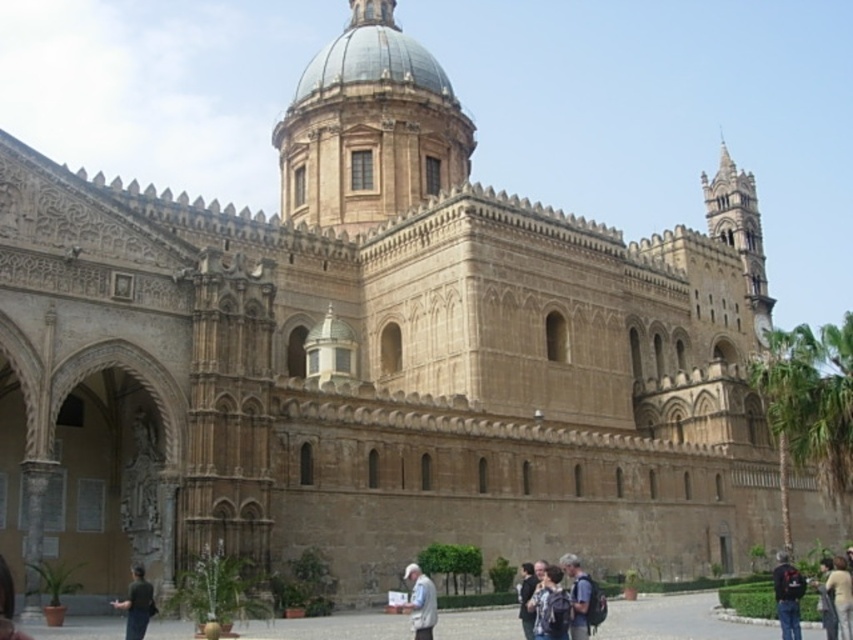
Question: Is light brown leather jacket at lower right smaller than dark gray backpack at lower center?

Choices:
 (A) no
 (B) yes

Answer: (A)

Question: Does light gray fabric jacket at lower center appear over light brown leather jacket at lower right?

Choices:
 (A) no
 (B) yes

Answer: (B)

Question: Is black fabric backpack at lower right to the left of light brown leather jacket at lower right from the viewer's perspective?

Choices:
 (A) no
 (B) yes

Answer: (B)

Question: Which point appears closest to the camera in this image?

Choices:
 (A) (4, 612)
 (B) (532, 577)
 (C) (828, 577)
 (D) (550, 577)

Answer: (A)

Question: Among these objects, which one is nearest to the camera?

Choices:
 (A) dark gray backpack at lower center
 (B) light brown leather jacket at center
 (C) white fabric shirt at center
 (D) light brown leather jacket at lower right

Answer: (C)

Question: Which of the following is the farthest from the observer?

Choices:
 (A) white fabric shirt at center
 (B) dark gray backpack at lower center
 (C) light gray fabric jacket at lower center

Answer: (B)